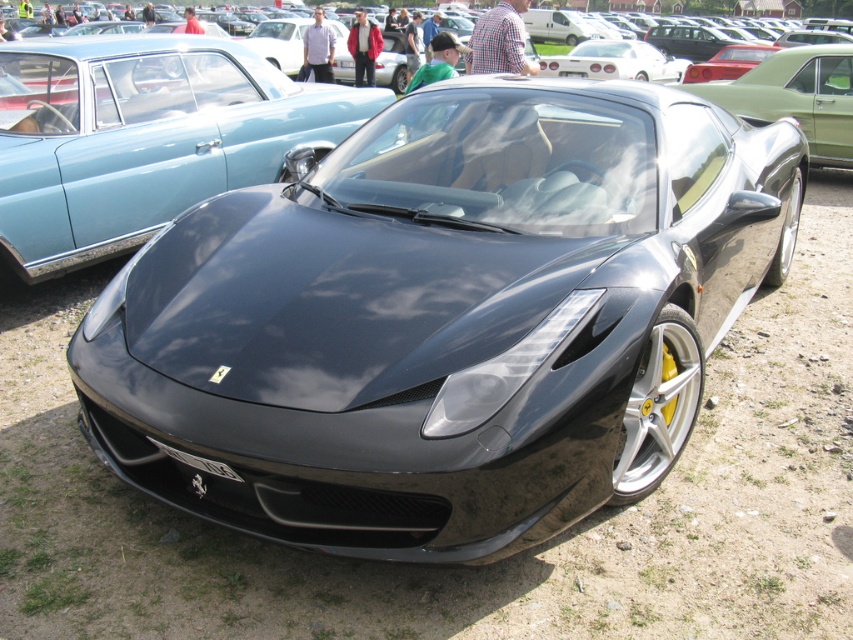
Question: Does matte blue sedan at center have a smaller size compared to black matte license plate at center?

Choices:
 (A) no
 (B) yes

Answer: (A)

Question: Which object appears closest to the camera in this image?

Choices:
 (A) matte blue sedan at center
 (B) black matte license plate at center

Answer: (B)

Question: Does matte blue sedan at center appear under black matte license plate at center?

Choices:
 (A) no
 (B) yes

Answer: (A)

Question: Which point is farther to the camera?

Choices:
 (A) (328, 120)
 (B) (177, 458)

Answer: (A)

Question: Can you confirm if matte blue sedan at center is bigger than black matte license plate at center?

Choices:
 (A) yes
 (B) no

Answer: (A)

Question: Which of the following is the closest to the observer?

Choices:
 (A) (223, 476)
 (B) (6, 237)

Answer: (A)